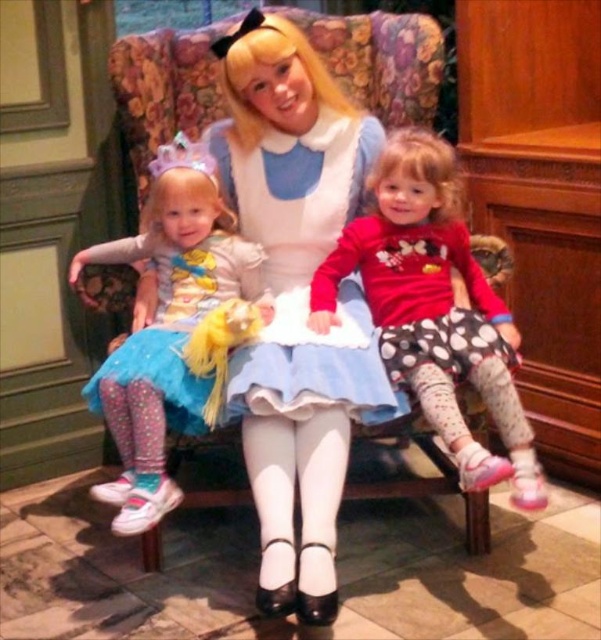
You are a photographer standing in front of the vintage armchair with three people sitting on it. You notice two points marked on the chair at coordinates point (400,104) and point (424,332). Which of these two points is closer to you?

Point (400,104) is further to the viewer than point (424,332), so the point closer to you is point (424,332).

You are a photographer setting up a shoot in the scene described. You need to place a small stool for a prop. The stool must be placed in an area where it won not block the view of the floral fabric armchair at center and the matte white dress at center. Considering their heights, where should you place the stool?

The stool should be placed in front of the floral fabric armchair at center because the matte white dress at center is taller than the armchair. Placing the stool in front ensures it won not block the view of both objects as the dress is taller and would be visible over the stool.